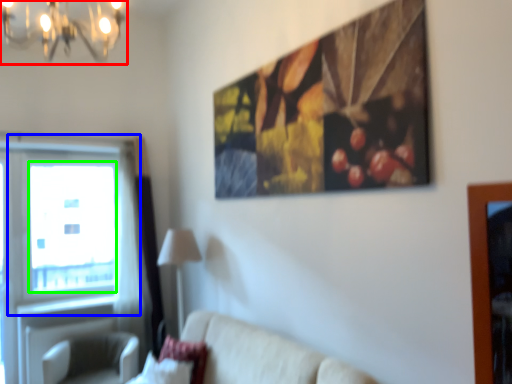
Question: Which object is positioned closest to light fixture (highlighted by a red box)? Select from window (highlighted by a blue box) and window screen (highlighted by a green box).

Choices:
 (A) window
 (B) window screen

Answer: (A)